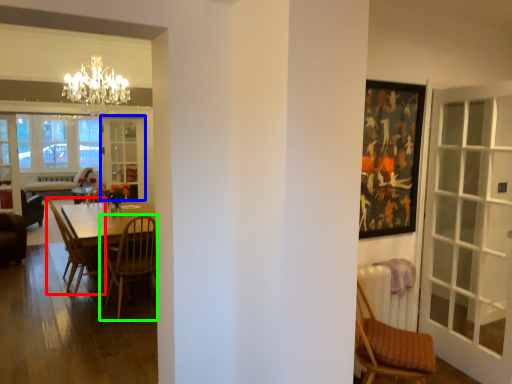
Question: Considering the real-world distances, which object is closest to chair (highlighted by a red box)? screen door (highlighted by a blue box) or chair (highlighted by a green box).

Choices:
 (A) screen door
 (B) chair

Answer: (B)